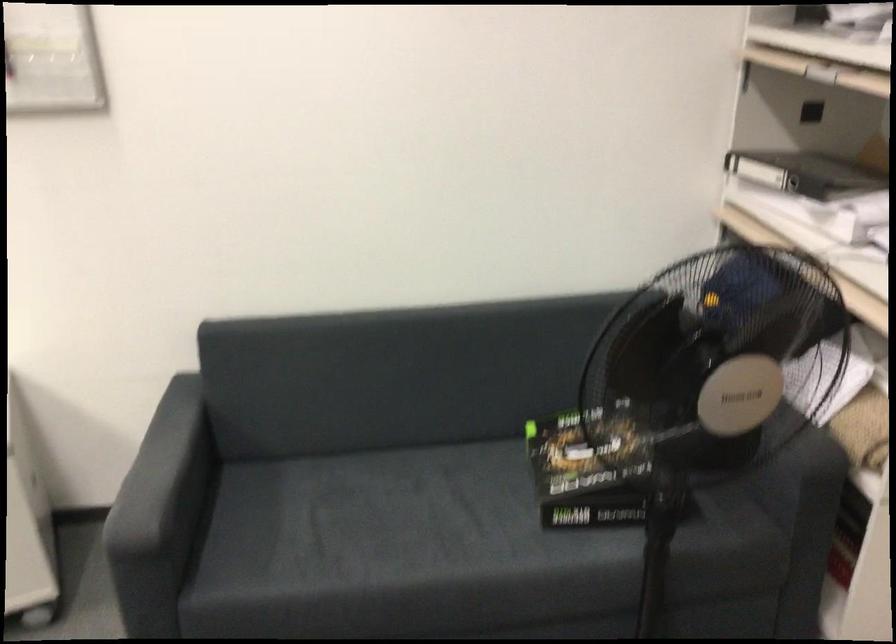
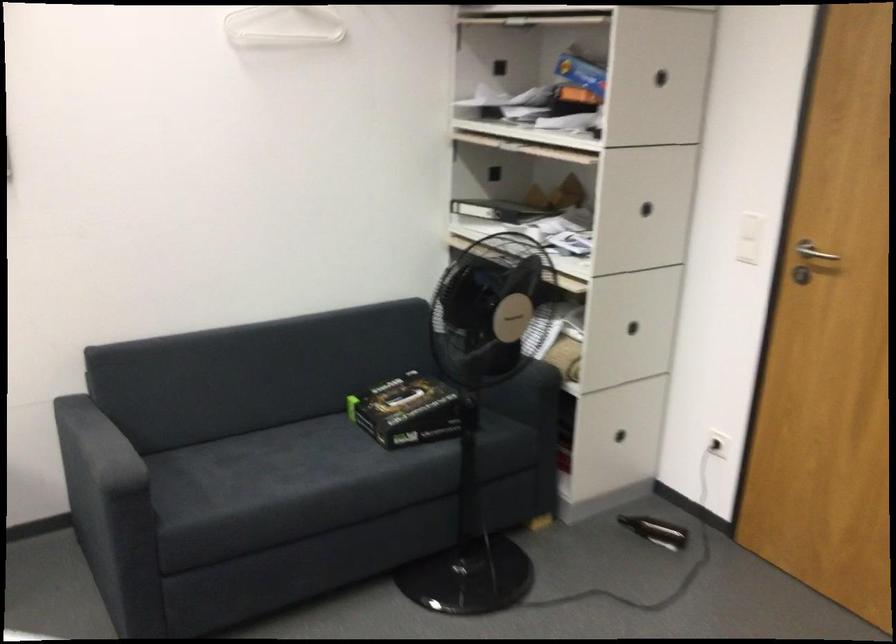
The images are taken continuously from a first-person perspective. In which direction are you moving?

The movement direction of the cameraman is left, backward.